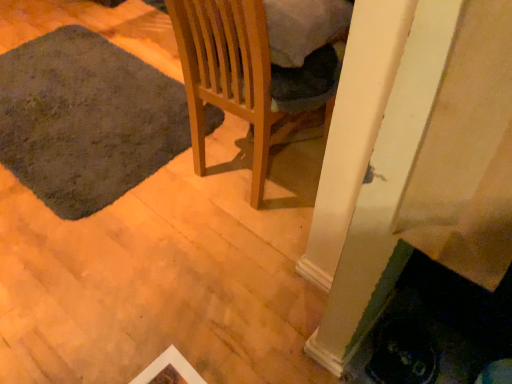
Question: Considering the positions of wooden chair at center and dark gray carpet at lower left in the image, is wooden chair at center wider or thinner than dark gray carpet at lower left?

Choices:
 (A) wide
 (B) thin

Answer: (B)

Question: Considering the positions of wooden chair at center and dark gray carpet at lower left in the image, is wooden chair at center bigger or smaller than dark gray carpet at lower left?

Choices:
 (A) small
 (B) big

Answer: (B)

Question: Is wooden chair at center situated inside dark gray carpet at lower left or outside?

Choices:
 (A) inside
 (B) outside

Answer: (B)

Question: Considering the positions of dark gray carpet at lower left and wooden chair at center in the image, is dark gray carpet at lower left bigger or smaller than wooden chair at center?

Choices:
 (A) small
 (B) big

Answer: (A)

Question: Is dark gray carpet at lower left inside or outside of wooden chair at center?

Choices:
 (A) outside
 (B) inside

Answer: (A)

Question: Visually, is dark gray carpet at lower left positioned to the left or to the right of wooden chair at center?

Choices:
 (A) left
 (B) right

Answer: (A)

Question: Looking at their shapes, would you say dark gray carpet at lower left is wider or thinner than wooden chair at center?

Choices:
 (A) wide
 (B) thin

Answer: (A)